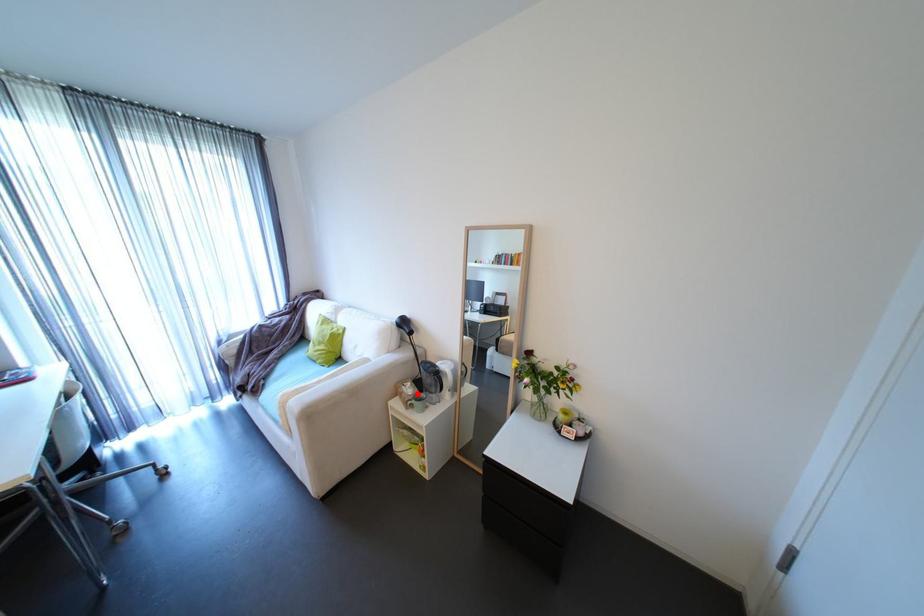
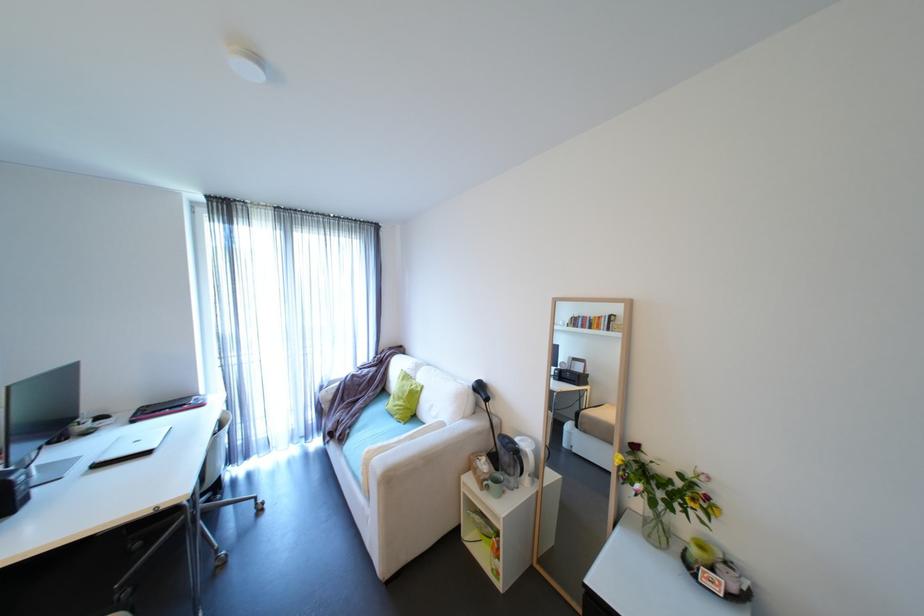
Question: I am providing you with two images of the same scene from different viewpoints. Image1 has a red point marked. In image2, the corresponding 3D location appears at what relative position? Reply with the corresponding letter.

Choices:
 (A) Closer
 (B) Farther

Answer: (A)